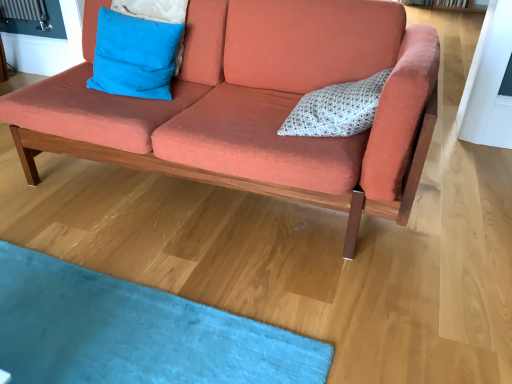
The width and height of the screenshot is (512, 384). Describe the element at coordinates (255, 106) in the screenshot. I see `coral fabric couch at center` at that location.

What do you see at coordinates (134, 55) in the screenshot? I see `blue suede pillow at upper left, the 1th pillow from the left` at bounding box center [134, 55].

This screenshot has height=384, width=512. I want to click on coral fabric couch at center, so click(255, 106).

From a real-world perspective, is coral fabric couch at center physically located above or below blue suede pillow at upper left, the 1th pillow from the left?

Clearly, from a real-world perspective, coral fabric couch at center is below blue suede pillow at upper left, the 1th pillow from the left.

How different are the orientations of coral fabric couch at center and blue suede pillow at upper left, which ranks as the second pillow in right-to-left order, in degrees?

coral fabric couch at center and blue suede pillow at upper left, which ranks as the second pillow in right-to-left order, are facing 0.000143 degrees away from each other.

From the image's perspective, which one is positioned higher, coral fabric couch at center or blue suede pillow at upper left, the 1th pillow from the left?

blue suede pillow at upper left, the 1th pillow from the left, from the image's perspective.

Does coral fabric couch at center come in front of blue suede pillow at upper left, the 1th pillow from the left?

Yes, coral fabric couch at center is closer to the camera.

Between white dotted fabric pillow at center, acting as the 2th pillow starting from the left, and blue suede pillow at upper left, which ranks as the second pillow in right-to-left order, which one has larger width?

white dotted fabric pillow at center, acting as the 2th pillow starting from the left, is wider.

Considering the relative positions of white dotted fabric pillow at center, which ranks as the 1th pillow in right-to-left order, and blue suede pillow at upper left, which ranks as the second pillow in right-to-left order, in the image provided, is white dotted fabric pillow at center, which ranks as the 1th pillow in right-to-left order, to the left or to the right of blue suede pillow at upper left, which ranks as the second pillow in right-to-left order,?

white dotted fabric pillow at center, which ranks as the 1th pillow in right-to-left order, is positioned on blue suede pillow at upper left, which ranks as the second pillow in right-to-left order,'s right side.

The image size is (512, 384). In order to click on pillow above the white dotted fabric pillow at center, which ranks as the 1th pillow in right-to-left order (from the image's perspective) in this screenshot , I will do `click(134, 55)`.

Could coral fabric couch at center be considered to be inside blue suede pillow at upper left, the 1th pillow from the left?

No, blue suede pillow at upper left, the 1th pillow from the left, does not contain coral fabric couch at center.

Considering the positions of objects blue suede pillow at upper left, which ranks as the second pillow in right-to-left order, and coral fabric couch at center in the image provided, who is behind, blue suede pillow at upper left, which ranks as the second pillow in right-to-left order, or coral fabric couch at center?

blue suede pillow at upper left, which ranks as the second pillow in right-to-left order, is further away from the camera.

Is blue suede pillow at upper left, which ranks as the second pillow in right-to-left order, looking in the opposite direction of coral fabric couch at center?

Correct, blue suede pillow at upper left, which ranks as the second pillow in right-to-left order, is looking away from coral fabric couch at center.

From a real-world perspective, is blue suede pillow at upper left, which ranks as the second pillow in right-to-left order, on top of coral fabric couch at center?

Yes, from a real-world perspective, blue suede pillow at upper left, which ranks as the second pillow in right-to-left order, is over coral fabric couch at center

Which is farther from the camera, (309, 94) or (173, 159)?

The point (309, 94) is farther from the camera.

Which of these two, white dotted fabric pillow at center, acting as the 2th pillow starting from the left, or coral fabric couch at center, is bigger?

Bigger between the two is coral fabric couch at center.

Looking at their sizes, would you say white dotted fabric pillow at center, acting as the 2th pillow starting from the left, is wider or thinner than coral fabric couch at center?

white dotted fabric pillow at center, acting as the 2th pillow starting from the left, is thinner than coral fabric couch at center.

Does white dotted fabric pillow at center, which ranks as the 1th pillow in right-to-left order, have a lesser height compared to coral fabric couch at center?

Indeed, white dotted fabric pillow at center, which ranks as the 1th pillow in right-to-left order, has a lesser height compared to coral fabric couch at center.

In terms of height, does blue suede pillow at upper left, the 1th pillow from the left, look taller or shorter compared to white dotted fabric pillow at center, which ranks as the 1th pillow in right-to-left order?

Clearly, blue suede pillow at upper left, the 1th pillow from the left, is taller compared to white dotted fabric pillow at center, which ranks as the 1th pillow in right-to-left order.

Does blue suede pillow at upper left, the 1th pillow from the left, turn towards white dotted fabric pillow at center, which ranks as the 1th pillow in right-to-left order?

No, blue suede pillow at upper left, the 1th pillow from the left, is not facing towards white dotted fabric pillow at center, which ranks as the 1th pillow in right-to-left order.

Considering the positions of objects blue suede pillow at upper left, the 1th pillow from the left, and white dotted fabric pillow at center, acting as the 2th pillow starting from the left, in the image provided, who is in front, blue suede pillow at upper left, the 1th pillow from the left, or white dotted fabric pillow at center, acting as the 2th pillow starting from the left,?

white dotted fabric pillow at center, acting as the 2th pillow starting from the left, is in front.

Considering the relative sizes of blue suede pillow at upper left, which ranks as the second pillow in right-to-left order, and white dotted fabric pillow at center, which ranks as the 1th pillow in right-to-left order, in the image provided, is blue suede pillow at upper left, which ranks as the second pillow in right-to-left order, bigger than white dotted fabric pillow at center, which ranks as the 1th pillow in right-to-left order,?

Indeed, blue suede pillow at upper left, which ranks as the second pillow in right-to-left order, has a larger size compared to white dotted fabric pillow at center, which ranks as the 1th pillow in right-to-left order.

Considering the sizes of coral fabric couch at center and white dotted fabric pillow at center, which ranks as the 1th pillow in right-to-left order, in the image, is coral fabric couch at center taller or shorter than white dotted fabric pillow at center, which ranks as the 1th pillow in right-to-left order,?

coral fabric couch at center is taller than white dotted fabric pillow at center, which ranks as the 1th pillow in right-to-left order.

Looking at this image, does coral fabric couch at center have a smaller size compared to white dotted fabric pillow at center, acting as the 2th pillow starting from the left?

Actually, coral fabric couch at center might be larger than white dotted fabric pillow at center, acting as the 2th pillow starting from the left.

Considering the positions of objects coral fabric couch at center and white dotted fabric pillow at center, acting as the 2th pillow starting from the left, in the image provided, who is more to the right, coral fabric couch at center or white dotted fabric pillow at center, acting as the 2th pillow starting from the left,?

Positioned to the right is white dotted fabric pillow at center, acting as the 2th pillow starting from the left.

Is coral fabric couch at center oriented away from white dotted fabric pillow at center, which ranks as the 1th pillow in right-to-left order?

Yes, coral fabric couch at center is facing away from white dotted fabric pillow at center, which ranks as the 1th pillow in right-to-left order.

At what (x,y) coordinates should I click in order to perform the action: click on studio couch in front of the blue suede pillow at upper left, the 1th pillow from the left. Please return your answer as a coordinate pair (x, y). Looking at the image, I should click on (255, 106).

In order to click on pillow above the white dotted fabric pillow at center, which ranks as the 1th pillow in right-to-left order (from the image's perspective) in this screenshot , I will do `click(134, 55)`.

Looking at the image, which one is located further to coral fabric couch at center, blue suede pillow at upper left, the 1th pillow from the left, or white dotted fabric pillow at center, acting as the 2th pillow starting from the left?

blue suede pillow at upper left, the 1th pillow from the left, is positioned further to the anchor coral fabric couch at center.

Looking at the image, which one is located further to blue suede pillow at upper left, the 1th pillow from the left, coral fabric couch at center or white dotted fabric pillow at center, acting as the 2th pillow starting from the left?

Among the two, white dotted fabric pillow at center, acting as the 2th pillow starting from the left, is located further to blue suede pillow at upper left, the 1th pillow from the left.

Based on their spatial positions, is blue suede pillow at upper left, which ranks as the second pillow in right-to-left order, or coral fabric couch at center closer to white dotted fabric pillow at center, which ranks as the 1th pillow in right-to-left order?

Based on the image, coral fabric couch at center appears to be nearer to white dotted fabric pillow at center, which ranks as the 1th pillow in right-to-left order.

Estimate the real-world distances between objects in this image. Which object is further from white dotted fabric pillow at center, which ranks as the 1th pillow in right-to-left order, coral fabric couch at center or blue suede pillow at upper left, the 1th pillow from the left?

blue suede pillow at upper left, the 1th pillow from the left, is positioned further to the anchor white dotted fabric pillow at center, which ranks as the 1th pillow in right-to-left order.

Looking at the image, which one is located closer to blue suede pillow at upper left, the 1th pillow from the left, white dotted fabric pillow at center, which ranks as the 1th pillow in right-to-left order, or coral fabric couch at center?

The object closer to blue suede pillow at upper left, the 1th pillow from the left, is coral fabric couch at center.

Considering their positions, is white dotted fabric pillow at center, acting as the 2th pillow starting from the left, positioned further to coral fabric couch at center than blue suede pillow at upper left, which ranks as the second pillow in right-to-left order?

blue suede pillow at upper left, which ranks as the second pillow in right-to-left order, is positioned further to the anchor coral fabric couch at center.

The image size is (512, 384). What are the coordinates of `studio couch between blue suede pillow at upper left, the 1th pillow from the left, and white dotted fabric pillow at center, acting as the 2th pillow starting from the left, in the horizontal direction` in the screenshot? It's located at (255, 106).